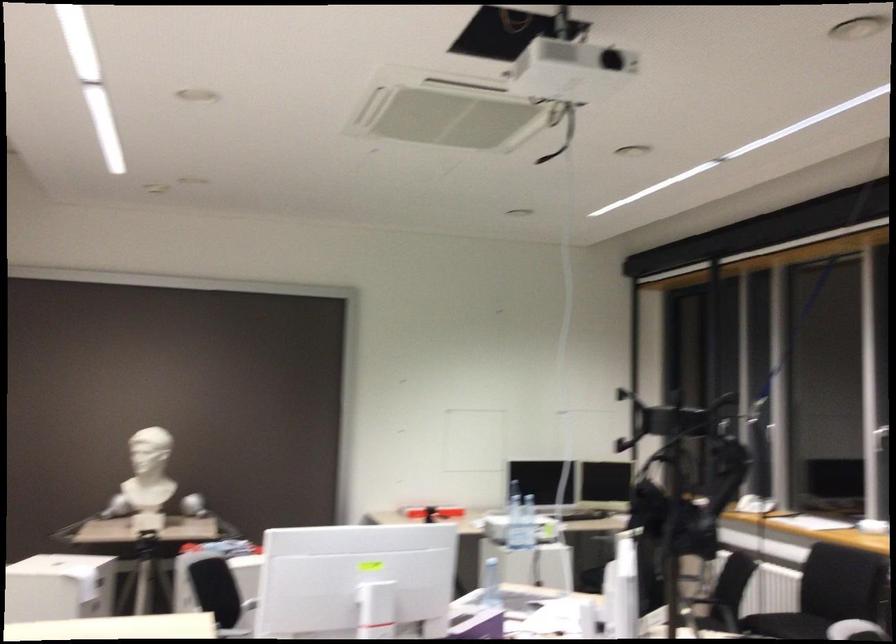
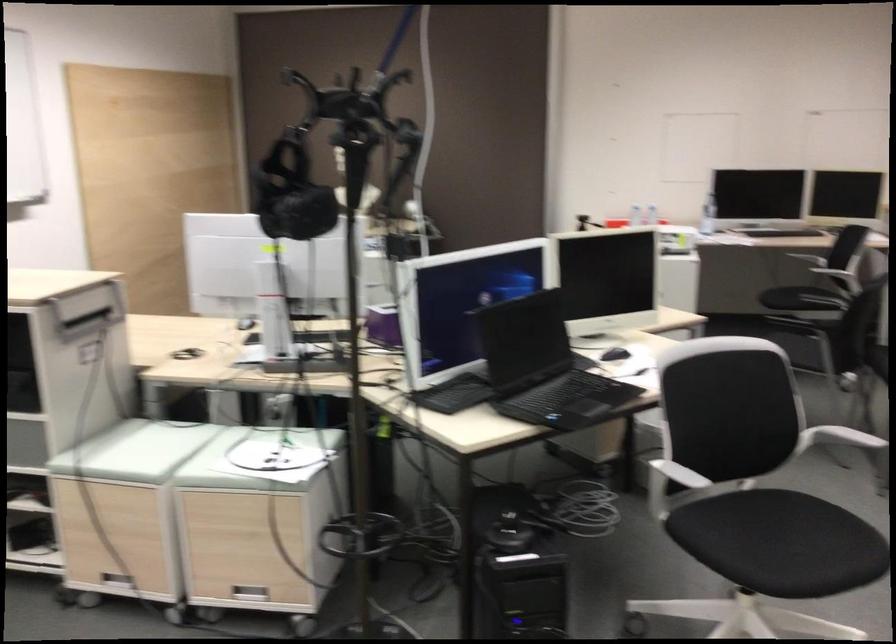
The point at (x=692, y=498) is marked in the first image. Where is the corresponding point in the second image?

(291, 192)